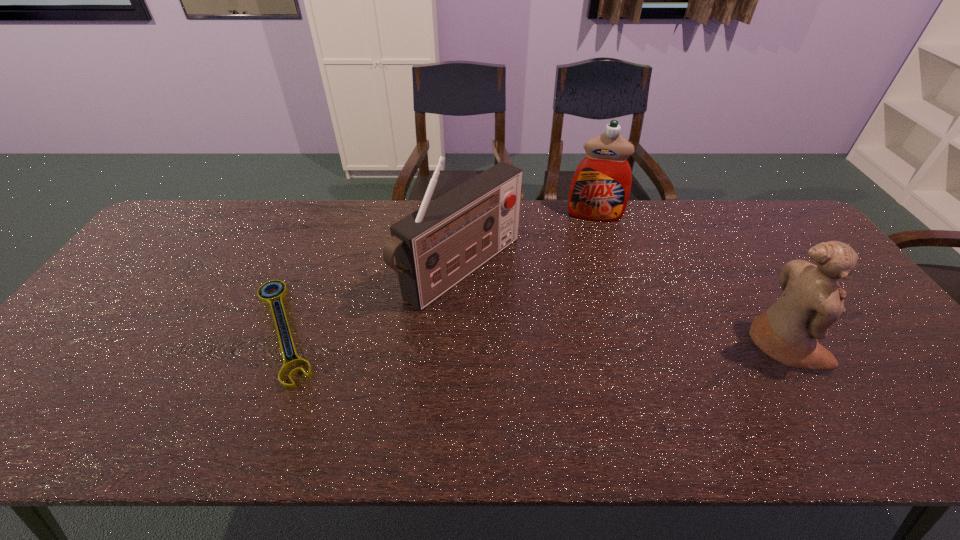
Identify the location of the leftmost object. (274, 298).

This screenshot has width=960, height=540. Find the location of `wrench`. wrench is located at coordinates (274, 298).

Image resolution: width=960 pixels, height=540 pixels. Identify the location of the rightmost object. (812, 300).

Locate an element on the screen. the third object from left to right is located at coordinates (600, 188).

This screenshot has height=540, width=960. Identify the location of detergent. (600, 188).

The width and height of the screenshot is (960, 540). In order to click on radio receiver in this screenshot , I will do click(435, 247).

Image resolution: width=960 pixels, height=540 pixels. Find the location of `vacant space situated 0.080m on the left of the wrench`. vacant space situated 0.080m on the left of the wrench is located at coordinates (210, 330).

At what (x,y) coordinates should I click in order to perform the action: click on vacant space located on the front-facing side of the figurine. Please return your answer as a coordinate pair (x, y). Image resolution: width=960 pixels, height=540 pixels. Looking at the image, I should click on (874, 346).

You are a GUI agent. You are given a task and a screenshot of the screen. Output one action in this format:
    pyautogui.click(x=<x>, y=<y>)
    Task: Click on the vacant space located 0.330m on the front surface of the farthest object
    
    Given the screenshot: What is the action you would take?
    pyautogui.click(x=588, y=294)

I want to click on free space located 0.320m on the front surface of the farthest object, so click(x=589, y=291).